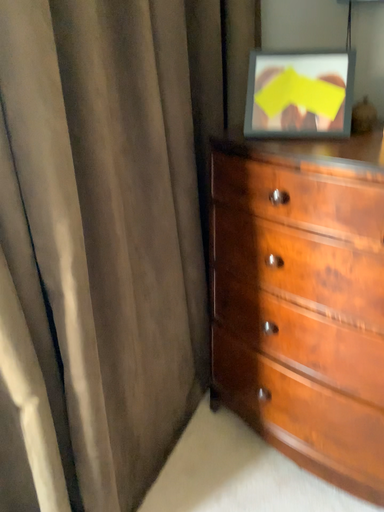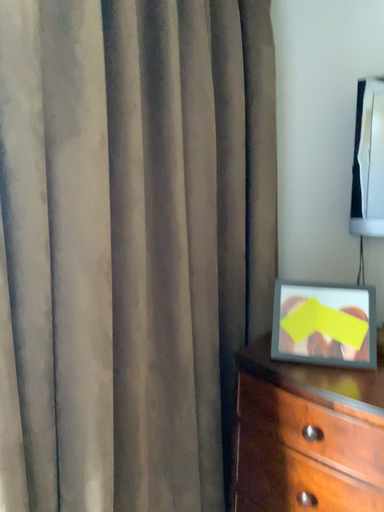
Question: Which way did the camera rotate in the video?

Choices:
 (A) rotated upward
 (B) rotated downward

Answer: (A)